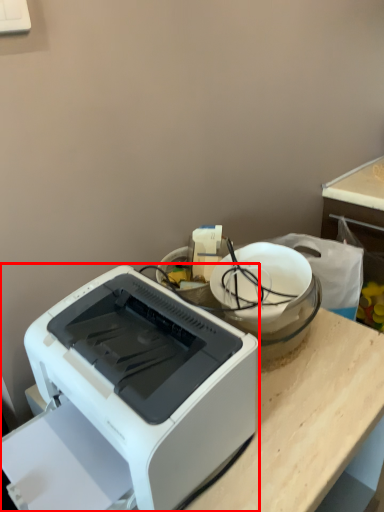
Question: From the image's perspective, where is printer (annotated by the red box) located relative to appliance?

Choices:
 (A) above
 (B) below

Answer: (B)